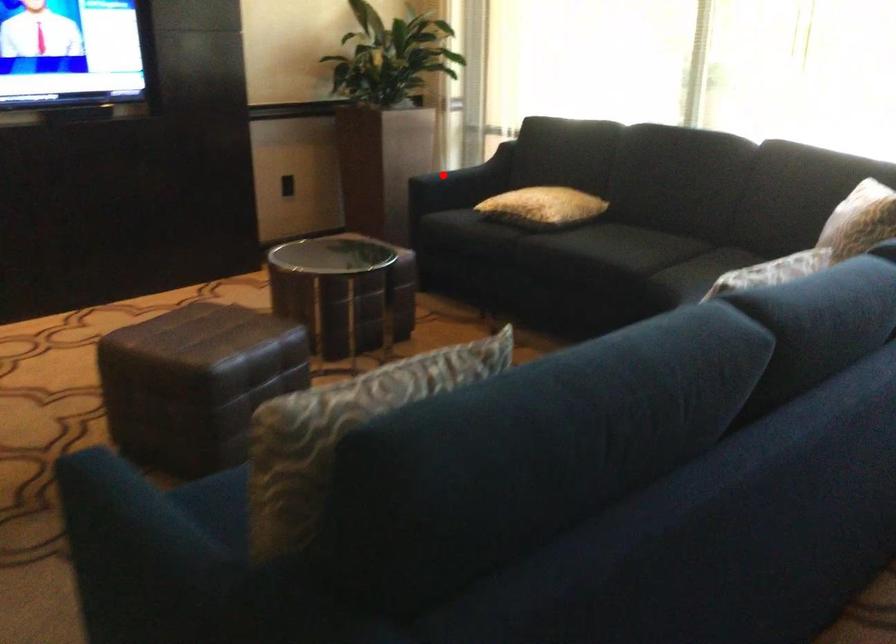
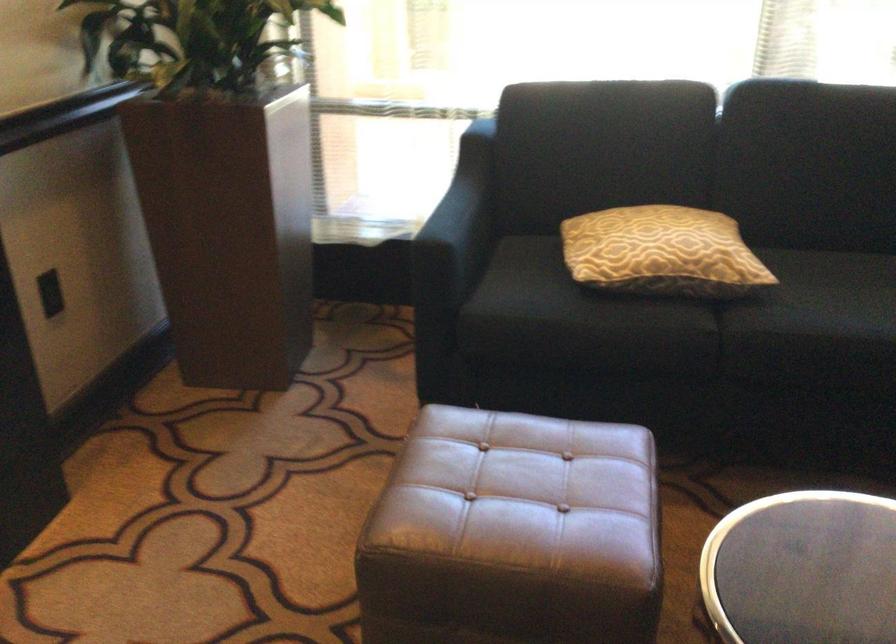
Question: I am providing you with two images of the same scene from different viewpoints. In image1, a red point is highlighted. Considering the same 3D point in image2, which of the following is correct?

Choices:
 (A) It is closer
 (B) It is farther

Answer: (A)